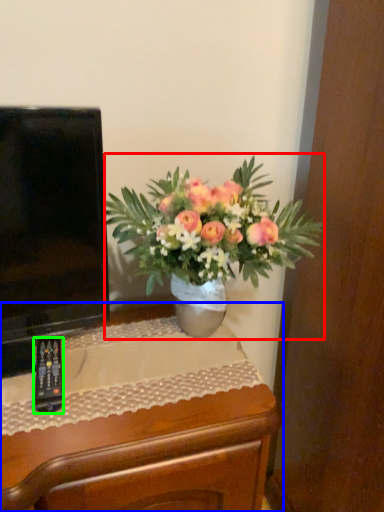
Question: Estimate the real-world distances between objects in this image. Which object is closer to houseplant (highlighted by a red box), desk (highlighted by a blue box) or remote control (highlighted by a green box)?

Choices:
 (A) desk
 (B) remote control

Answer: (A)